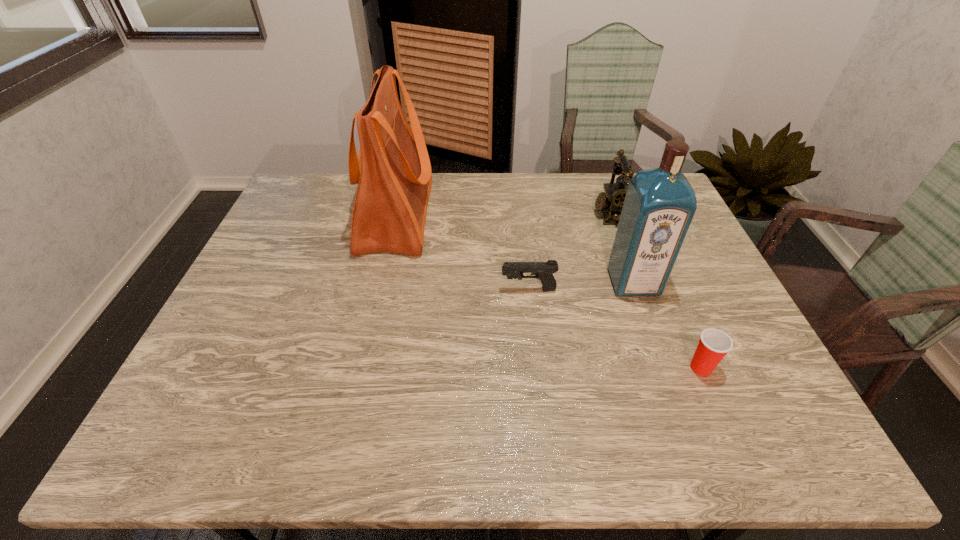
Identify the location of free location located at the barrel of the second object from left to right. (366, 289).

Identify the location of vacant space located at the barrel of the second object from left to right. The width and height of the screenshot is (960, 540). (388, 289).

Find the location of `vacant area situated at the barrel of the second object from left to right`. vacant area situated at the barrel of the second object from left to right is located at coordinates (362, 289).

You are a GUI agent. You are given a task and a screenshot of the screen. Output one action in this format:
    pyautogui.click(x=<x>, y=<y>)
    Task: Click on the free space located on the left of the Dixie cup
    This screenshot has height=540, width=960.
    Given the screenshot: What is the action you would take?
    tap(615, 368)

Identify the location of shopping bag located in the far edge section of the desktop. This screenshot has width=960, height=540. (393, 172).

Image resolution: width=960 pixels, height=540 pixels. I want to click on telephone located at the far edge, so click(613, 198).

Identify the location of object at the right edge. (714, 344).

At what (x,y) coordinates should I click in order to perform the action: click on vacant space at the far edge of the desktop. Please return your answer as a coordinate pair (x, y). The image size is (960, 540). Looking at the image, I should click on (357, 191).

Image resolution: width=960 pixels, height=540 pixels. I want to click on vacant region at the near edge of the desktop, so click(680, 446).

You are a GUI agent. You are given a task and a screenshot of the screen. Output one action in this format:
    pyautogui.click(x=<x>, y=<y>)
    Task: Click on the blank space at the left edge of the desktop
    
    Given the screenshot: What is the action you would take?
    pyautogui.click(x=229, y=392)